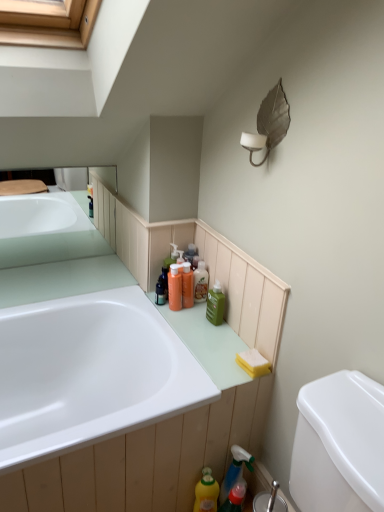
Question: Is orange plastic bottles at center, which is the first toiletry from left to right, looking in the opposite direction of yellow matte bottle at lower center, the third cleaning product viewed from the top?

Choices:
 (A) yes
 (B) no

Answer: (B)

Question: Is orange plastic bottles at center, which is the first toiletry from left to right, to the left of yellow matte bottle at lower center, the third cleaning product viewed from the top, from the viewer's perspective?

Choices:
 (A) no
 (B) yes

Answer: (B)

Question: Can you confirm if orange plastic bottles at center, which is counted as the second toiletry, starting from the right, is smaller than yellow matte bottle at lower center, the third cleaning product viewed from the top?

Choices:
 (A) yes
 (B) no

Answer: (A)

Question: From the image's perspective, would you say orange plastic bottles at center, which is counted as the second toiletry, starting from the right, is shown under yellow matte bottle at lower center, which is counted as the 1th cleaning product, starting from the bottom?

Choices:
 (A) yes
 (B) no

Answer: (B)

Question: Considering the relative sizes of orange plastic bottles at center, which is the first toiletry from left to right, and yellow matte bottle at lower center, which is counted as the 1th cleaning product, starting from the bottom, in the image provided, is orange plastic bottles at center, which is the first toiletry from left to right, wider than yellow matte bottle at lower center, which is counted as the 1th cleaning product, starting from the bottom,?

Choices:
 (A) no
 (B) yes

Answer: (A)

Question: Does orange plastic bottles at center, which is counted as the second toiletry, starting from the right, have a lesser height compared to yellow matte bottle at lower center, the third cleaning product viewed from the top?

Choices:
 (A) yes
 (B) no

Answer: (A)

Question: Considering the relative sizes of metallic leaf-shaped light fixture at upper right and orange plastic bottles at center, which is counted as the second toiletry, starting from the right, in the image provided, is metallic leaf-shaped light fixture at upper right taller than orange plastic bottles at center, which is counted as the second toiletry, starting from the right,?

Choices:
 (A) no
 (B) yes

Answer: (B)

Question: Does metallic leaf-shaped light fixture at upper right contain orange plastic bottles at center, which is the first toiletry from left to right?

Choices:
 (A) no
 (B) yes

Answer: (A)

Question: Does metallic leaf-shaped light fixture at upper right have a smaller size compared to orange plastic bottles at center, which is the first toiletry from left to right?

Choices:
 (A) no
 (B) yes

Answer: (A)

Question: Is metallic leaf-shaped light fixture at upper right aimed at orange plastic bottles at center, which is the first toiletry from left to right?

Choices:
 (A) yes
 (B) no

Answer: (B)

Question: Considering the relative positions of metallic leaf-shaped light fixture at upper right and orange plastic bottles at center, which is counted as the second toiletry, starting from the right, in the image provided, is metallic leaf-shaped light fixture at upper right behind orange plastic bottles at center, which is counted as the second toiletry, starting from the right,?

Choices:
 (A) no
 (B) yes

Answer: (A)

Question: Considering the relative sizes of metallic leaf-shaped light fixture at upper right and orange plastic bottles at center, which is counted as the second toiletry, starting from the right, in the image provided, is metallic leaf-shaped light fixture at upper right bigger than orange plastic bottles at center, which is counted as the second toiletry, starting from the right,?

Choices:
 (A) no
 (B) yes

Answer: (B)

Question: Is metallic leaf-shaped light fixture at upper right beside yellow sponge at lower right?

Choices:
 (A) no
 (B) yes

Answer: (A)